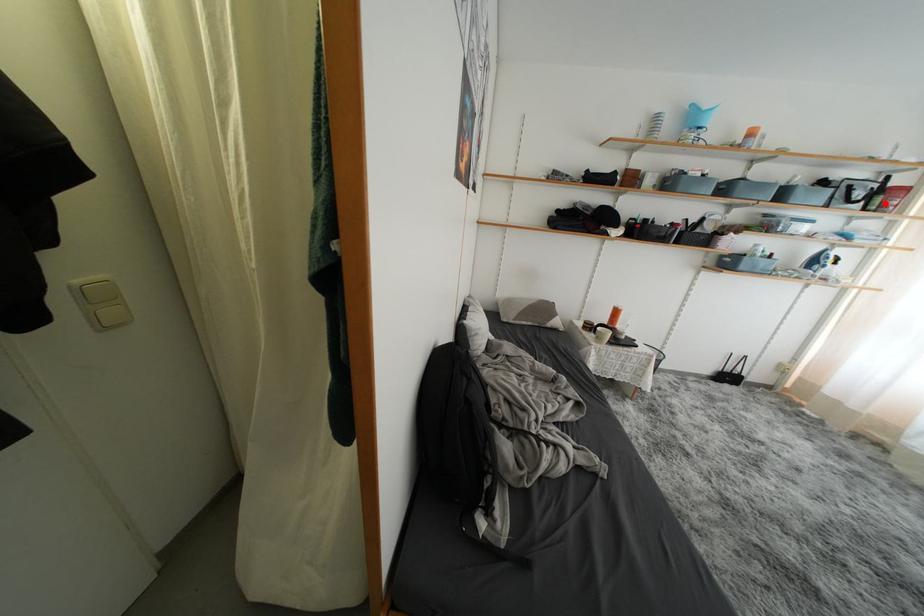
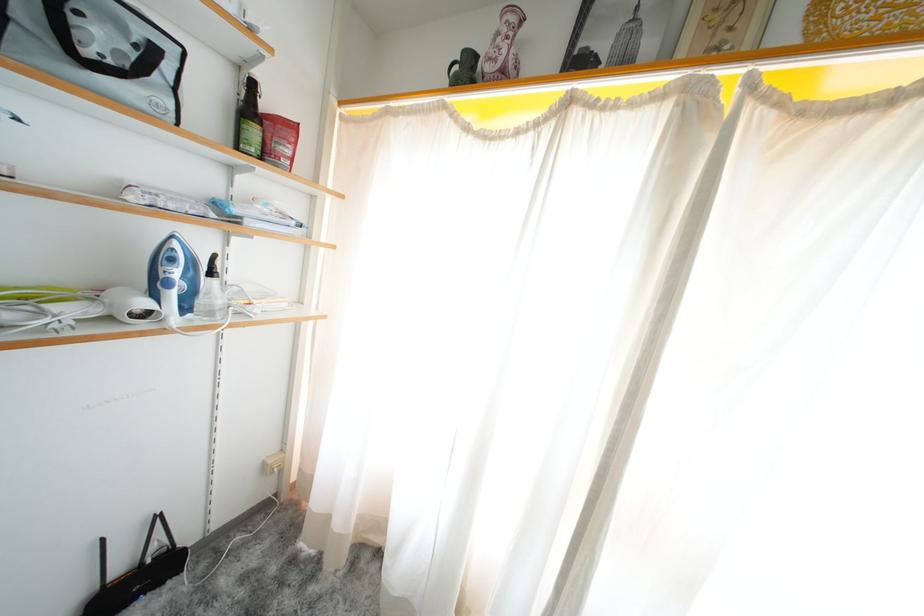
Find the pixel in the second image that matches the highlighted location in the first image.

(261, 137)